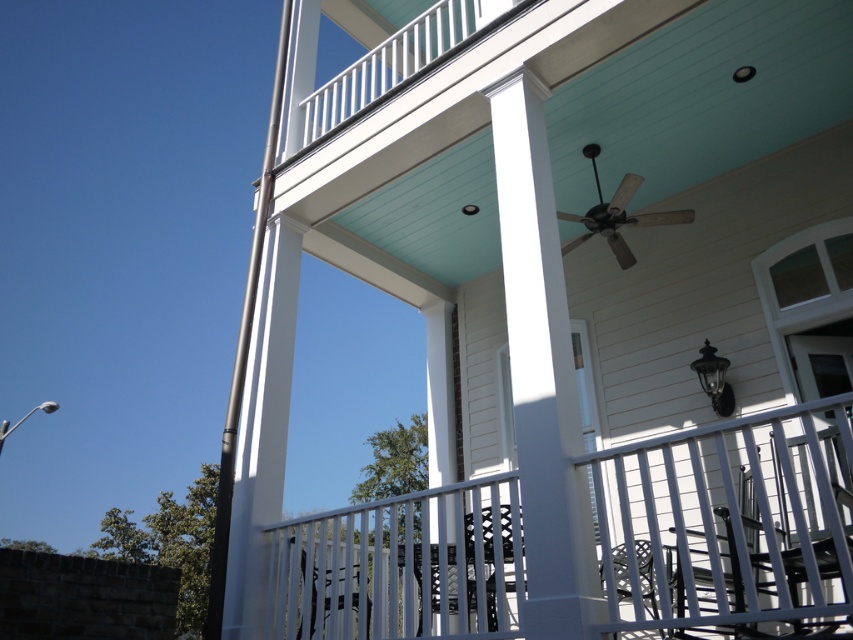
Question: Can you confirm if white metal railing at lower center is positioned to the right of white smooth column at center?

Choices:
 (A) no
 (B) yes

Answer: (B)

Question: Observing the image, what is the correct spatial positioning of white metal railing at lower center in reference to white smooth column at center?

Choices:
 (A) left
 (B) right

Answer: (B)

Question: Which point is closer to the camera?

Choices:
 (A) (840, 620)
 (B) (523, 128)

Answer: (A)

Question: Can you confirm if white metal railing at lower center is thinner than white smooth column at center?

Choices:
 (A) no
 (B) yes

Answer: (A)